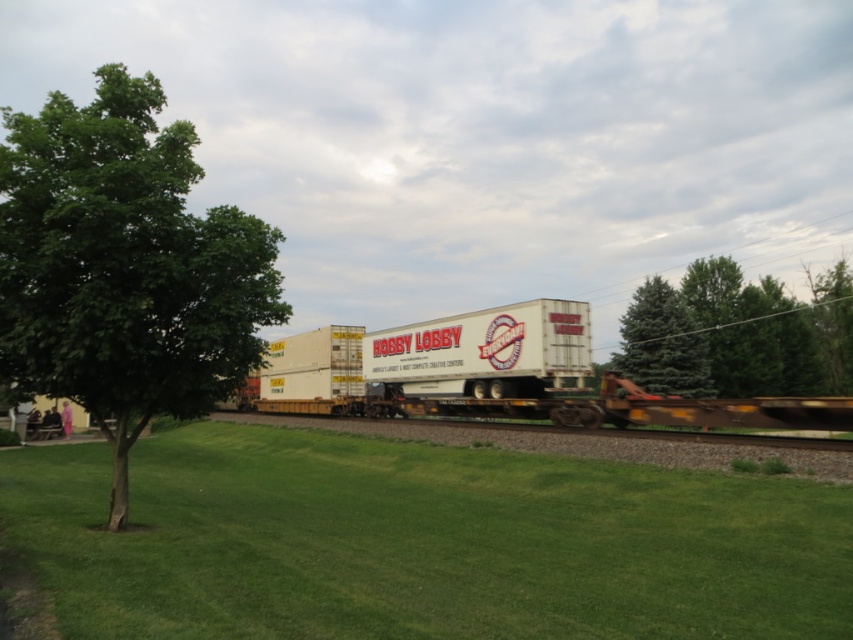
Question: Which point is closer to the camera?

Choices:
 (A) (126, 376)
 (B) (679, 324)
 (C) (822, 316)
 (D) (824, 278)

Answer: (A)

Question: Which point is farther from the camera taking this photo?

Choices:
 (A) (828, 387)
 (B) (318, 483)
 (C) (689, 312)

Answer: (A)

Question: Is green grass at center smaller than green leafy tree at right?

Choices:
 (A) yes
 (B) no

Answer: (A)

Question: Where is green leafy tree at left located in relation to green leafy tree at upper right in the image?

Choices:
 (A) left
 (B) right

Answer: (A)

Question: Which is nearer to the green leafy tree at upper right?

Choices:
 (A) green leafy tree at left
 (B) green leafy tree at right
 (C) green fir tree at right
 (D) green grass at center

Answer: (B)

Question: Considering the relative positions of green grass at center and green fir tree at right in the image provided, where is green grass at center located with respect to green fir tree at right?

Choices:
 (A) left
 (B) right

Answer: (A)